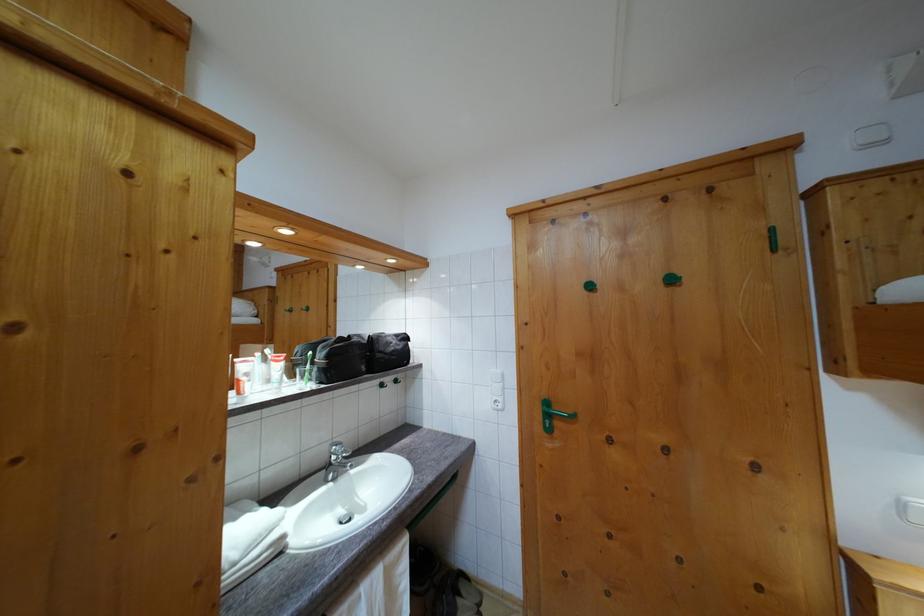
This screenshot has width=924, height=616. I want to click on green door handle, so click(555, 411).